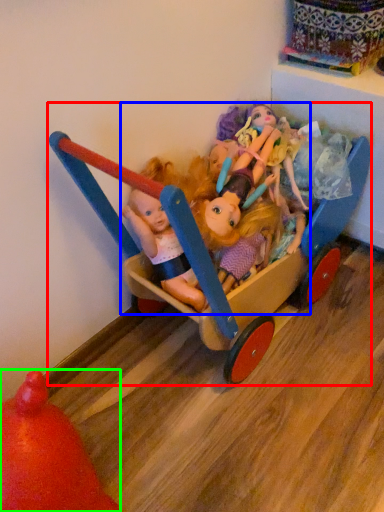
Question: Which object is the farthest from toy (highlighted by a red box)? Choose among these: doll (highlighted by a blue box) or toy (highlighted by a green box).

Choices:
 (A) doll
 (B) toy

Answer: (B)